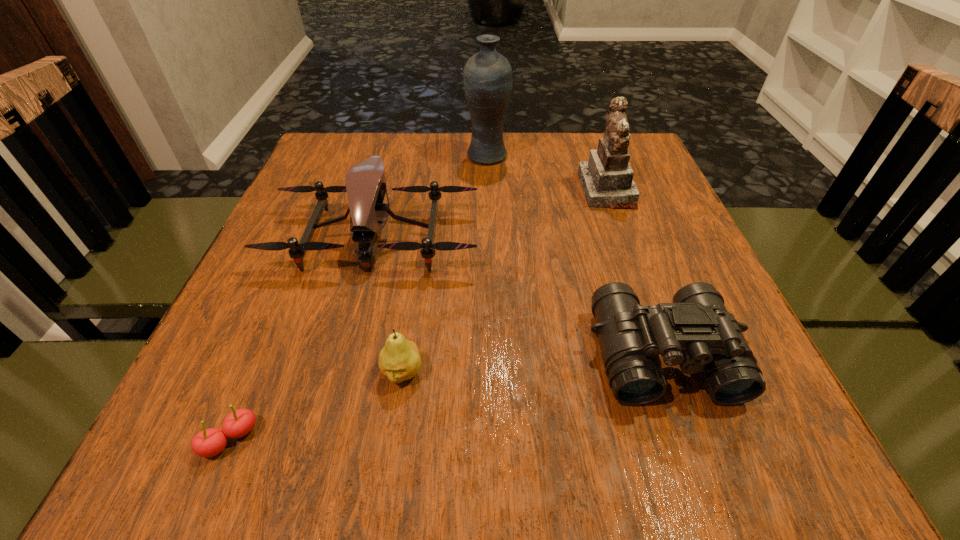
Find the location of a particular element. vase is located at coordinates (487, 79).

What are the coordinates of `the farthest object` in the screenshot? It's located at (487, 79).

Identify the location of figurine. This screenshot has width=960, height=540. (607, 178).

The height and width of the screenshot is (540, 960). What are the coordinates of `drone` in the screenshot? It's located at (365, 182).

Identify the location of the fourth tallest object. (696, 332).

Locate an element on the screen. Image resolution: width=960 pixels, height=540 pixels. pear is located at coordinates (399, 360).

Where is `the shortest object`? The width and height of the screenshot is (960, 540). the shortest object is located at coordinates (210, 442).

The image size is (960, 540). What are the coordinates of `cherry` in the screenshot? It's located at (210, 442).

Find the location of a particular element. vacant point located on the front of the tallest object is located at coordinates (490, 254).

The width and height of the screenshot is (960, 540). Find the location of `free region located on the front-facing side of the second tallest object`. free region located on the front-facing side of the second tallest object is located at coordinates (483, 190).